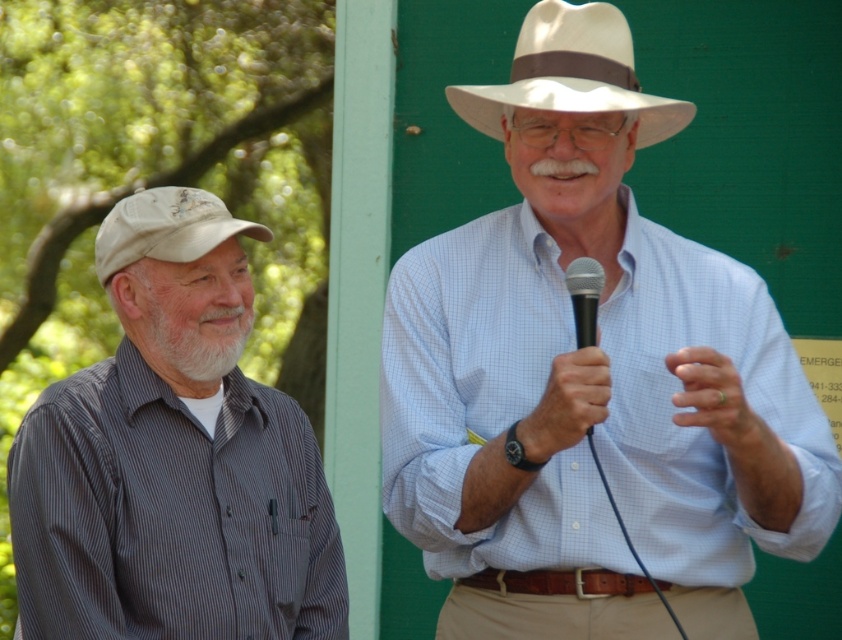
Does gray striped shirt at left appear over white felt fedora at upper center?

Actually, gray striped shirt at left is below white felt fedora at upper center.

Can you confirm if gray striped shirt at left is smaller than white felt fedora at upper center?

No.

Find the location of a particular element. gray striped shirt at left is located at coordinates (173, 458).

Which is above, white felt fedora at upper center or black plastic microphone at center?

white felt fedora at upper center is higher up.

Is the position of white felt fedora at upper center more distant than that of black plastic microphone at center?

Yes, white felt fedora at upper center is behind black plastic microphone at center.

Where is `white felt fedora at upper center`? The image size is (842, 640). white felt fedora at upper center is located at coordinates point(571,74).

Can you confirm if white felt fedora at upper center is positioned to the right of beige fabric cap at left?

Correct, you'll find white felt fedora at upper center to the right of beige fabric cap at left.

Is white felt fedora at upper center closer to the viewer compared to beige fabric cap at left?

Yes, it is in front of beige fabric cap at left.

Which is behind, point (627, 88) or point (102, 273)?

Positioned behind is point (627, 88).

I want to click on white felt fedora at upper center, so click(x=571, y=74).